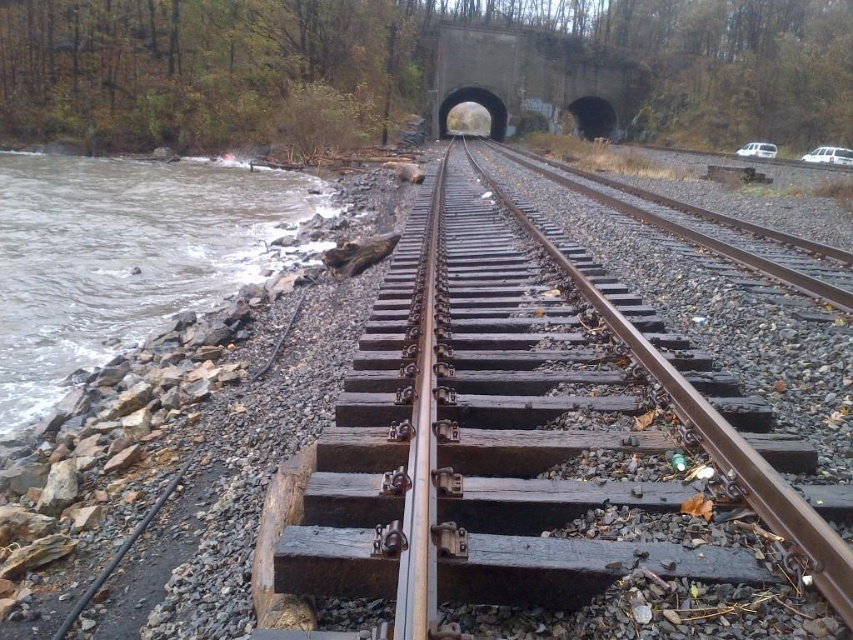
Is rusty metal track at center closer to the viewer compared to gray rocky river at left?

That is True.

Is point (480, 237) positioned after point (260, 180)?

No, (480, 237) is in front of (260, 180).

Where is `rusty metal track at center`? The width and height of the screenshot is (853, 640). rusty metal track at center is located at coordinates (531, 442).

Can you confirm if gray rocky river at left is taller than concrete/tunnel at center?

Incorrect, gray rocky river at left's height is not larger of concrete/tunnel at center's.

You are a GUI agent. You are given a task and a screenshot of the screen. Output one action in this format:
    pyautogui.click(x=<x>, y=<y>)
    Task: Click on the gray rocky river at left
    The height and width of the screenshot is (640, 853).
    Given the screenshot: What is the action you would take?
    pyautogui.click(x=123, y=256)

From the picture: Is rusty metal track at center positioned at the back of concrete/tunnel at center?

No, rusty metal track at center is in front of concrete/tunnel at center.

Is rusty metal track at center below concrete/tunnel at center?

Yes, rusty metal track at center is below concrete/tunnel at center.

In order to click on rusty metal track at center in this screenshot , I will do `click(531, 442)`.

At what (x,y) coordinates should I click in order to perform the action: click on rusty metal track at center. Please return your answer as a coordinate pair (x, y). Looking at the image, I should click on (531, 442).